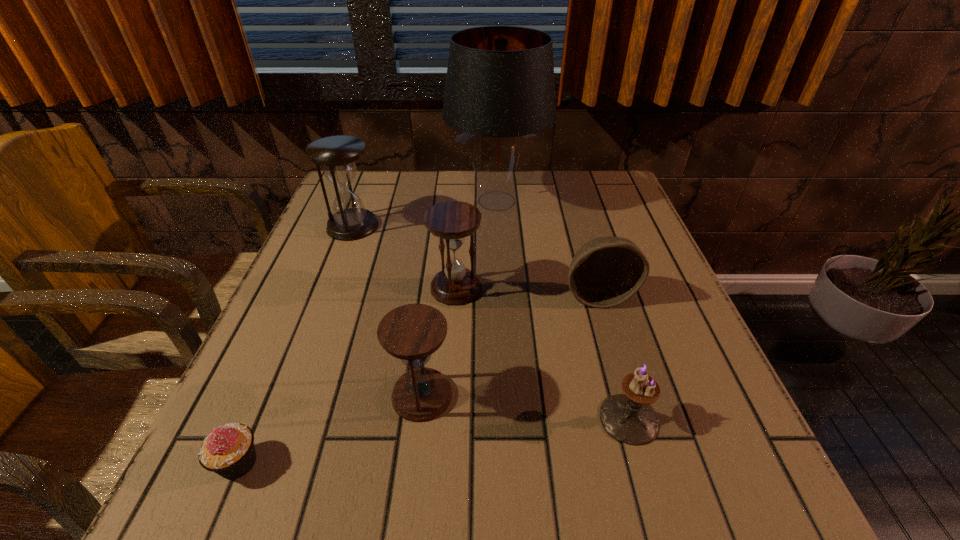
Point out which hourglass is positioned as the second nearest to the second farthest hourglass. Please provide its 2D coordinates. Your answer should be formatted as a tuple, i.e. [(x, y)], where the tuple contains the x and y coordinates of a point satisfying the conditions above.

[(337, 155)]

Image resolution: width=960 pixels, height=540 pixels. I want to click on vacant space that satisfies the following two spatial constraints: 1. on the back side of the bowl; 2. on the left side of the shortest object, so [309, 295].